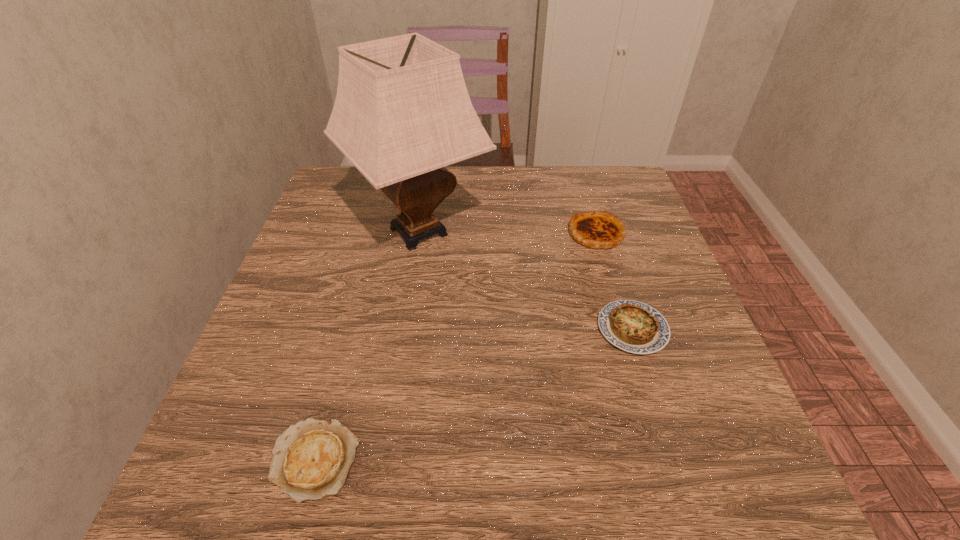
The image size is (960, 540). I want to click on vacant area that lies between the second shortest quiche and the shortest quiche, so click(473, 395).

You are a GUI agent. You are given a task and a screenshot of the screen. Output one action in this format:
    pyautogui.click(x=<x>, y=<y>)
    Task: Click on the unoccupied position between the second nearest object and the lampshade
    
    Given the screenshot: What is the action you would take?
    pyautogui.click(x=525, y=280)

Locate an element on the screen. This screenshot has width=960, height=540. object that is the closest to the farthest quiche is located at coordinates (633, 326).

Identify which object is the closest to the tallest quiche. Please provide its 2D coordinates. Your answer should be formatted as a tuple, i.e. [(x, y)], where the tuple contains the x and y coordinates of a point satisfying the conditions above.

[(633, 326)]

Choose which quiche is the second nearest neighbor to the second farthest quiche. Please provide its 2D coordinates. Your answer should be formatted as a tuple, i.e. [(x, y)], where the tuple contains the x and y coordinates of a point satisfying the conditions above.

[(311, 460)]

Select which quiche appears as the closest to the nearest quiche. Please provide its 2D coordinates. Your answer should be formatted as a tuple, i.e. [(x, y)], where the tuple contains the x and y coordinates of a point satisfying the conditions above.

[(633, 326)]

You are a GUI agent. You are given a task and a screenshot of the screen. Output one action in this format:
    pyautogui.click(x=<x>, y=<y>)
    Task: Click on the free space that satisfies the following two spatial constraints: 1. on the back side of the second shortest object; 2. on the left side of the nearest object
    The image size is (960, 540).
    Given the screenshot: What is the action you would take?
    pyautogui.click(x=349, y=329)

I want to click on free space that satisfies the following two spatial constraints: 1. on the back side of the shortest object; 2. on the left side of the third farthest object, so pos(349,329).

Locate an element on the screen. free spot that satisfies the following two spatial constraints: 1. on the front side of the second farthest quiche; 2. on the left side of the second tallest object is located at coordinates (625, 329).